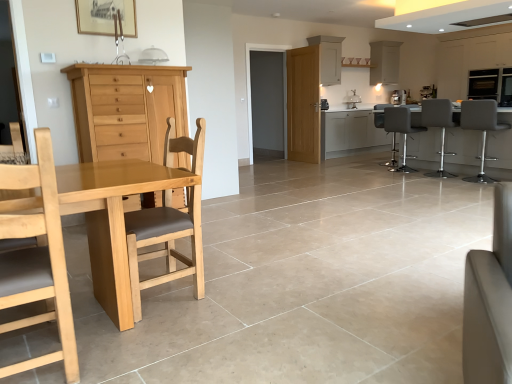
Find the location of a particular element. gray leather bar stool at right, which ranks as the sixth chair in front-to-back order is located at coordinates (392, 154).

The width and height of the screenshot is (512, 384). I want to click on white glossy cabinets at center, marked as the second cabinetry in a back-to-front arrangement, so pos(350,131).

What do you see at coordinates (126, 110) in the screenshot? I see `light brown wood cabinet at left, arranged as the 1th cabinetry when viewed from the left` at bounding box center [126, 110].

The image size is (512, 384). I want to click on matte gray door at center, so click(268, 103).

Is white glossy exhaust hood at upper center in contact with white matte cabinet at upper center, the third cabinetry viewed from the back?

No, white glossy exhaust hood at upper center is not next to white matte cabinet at upper center, the third cabinetry viewed from the back.

Is white glossy exhaust hood at upper center not within white matte cabinet at upper center, the third cabinetry viewed from the back?

Yes, white glossy exhaust hood at upper center is located beyond the bounds of white matte cabinet at upper center, the third cabinetry viewed from the back.

Considering the sizes of white glossy exhaust hood at upper center and white matte cabinet at upper center, the third cabinetry viewed from the back, in the image, is white glossy exhaust hood at upper center wider or thinner than white matte cabinet at upper center, the third cabinetry viewed from the back,?

white glossy exhaust hood at upper center is wider than white matte cabinet at upper center, the third cabinetry viewed from the back.

Consider the image. Is white glossy exhaust hood at upper center to the left or to the right of white matte cabinet at upper center, the fourth cabinetry in the right-to-left sequence, in the image?

Based on their positions, white glossy exhaust hood at upper center is located to the right of white matte cabinet at upper center, the fourth cabinetry in the right-to-left sequence.

Which is behind, light brown wood cabinet at left, arranged as the 1th cabinetry when viewed from the left, or light brown wood table at left?

Positioned behind is light brown wood cabinet at left, arranged as the 1th cabinetry when viewed from the left.

Is point (140, 156) less distant than point (123, 236)?

No, it is behind (123, 236).

From a real-world perspective, which object stands above the other?

In real-world perspective, light brown wood cabinet at left, arranged as the 1th cabinetry when viewed from the left, is above.

Between light brown wood cabinet at left, the fifth cabinetry in the right-to-left sequence, and light brown wood table at left, which one has more height?

With more height is light brown wood cabinet at left, the fifth cabinetry in the right-to-left sequence.

Between white leather couch at lower right and wooden picture frame at upper center, which one has larger width?

white leather couch at lower right.

Find the location of a particular element. This screenshot has width=512, height=384. picture frame above the white leather couch at lower right (from a real-world perspective) is located at coordinates (105, 17).

Which object is positioned more to the right, white leather couch at lower right or wooden picture frame at upper center?

Positioned to the right is white leather couch at lower right.

Considering the sizes of white leather couch at lower right and wooden picture frame at upper center in the image, is white leather couch at lower right taller or shorter than wooden picture frame at upper center?

Considering their sizes, white leather couch at lower right has more height than wooden picture frame at upper center.

Would you say matte grey bar stool at right, positioned as the third chair in left-to-right order, is outside white glossy cabinet at upper center, which ranks as the 1th cabinetry in back-to-front order?

Yes.

Considering the points (403, 130) and (384, 61), which point is in front, point (403, 130) or point (384, 61)?

The point (403, 130) is closer.

Looking at this image, between matte grey bar stool at right, which is the 4th chair in right-to-left order, and white glossy cabinet at upper center, which ranks as the 1th cabinetry in back-to-front order, which one has more height?

matte grey bar stool at right, which is the 4th chair in right-to-left order.

Considering the positions of objects wooden picture frame at upper center and light brown wood cabinet at left, arranged as the 1th cabinetry when viewed from the left, in the image provided, who is more to the left, wooden picture frame at upper center or light brown wood cabinet at left, arranged as the 1th cabinetry when viewed from the left,?

From the viewer's perspective, wooden picture frame at upper center appears more on the left side.

Between point (104, 10) and point (154, 113), which one is positioned in front?

The point (154, 113) is closer.

Is the depth of wooden picture frame at upper center less than that of light brown wood cabinet at left, which appears as the fifth cabinetry when viewed from the back?

No, wooden picture frame at upper center is further to the viewer.

Consider the image. Would you say wooden picture frame at upper center is outside light brown wood cabinet at left, arranged as the 1th cabinetry when viewed from the left?

wooden picture frame at upper center is positioned outside light brown wood cabinet at left, arranged as the 1th cabinetry when viewed from the left.

Where is `cabinetry that is the 2nd one when counting upward from the light brown wood chair at left, the sixth chair from the right (from the image's perspective)`? This screenshot has width=512, height=384. cabinetry that is the 2nd one when counting upward from the light brown wood chair at left, the sixth chair from the right (from the image's perspective) is located at coordinates (350, 131).

Considering the sizes of objects light brown wood chair at left, acting as the 6th chair starting from the back, and white glossy cabinets at center, which is the third cabinetry in right-to-left order, in the image provided, who is taller, light brown wood chair at left, acting as the 6th chair starting from the back, or white glossy cabinets at center, which is the third cabinetry in right-to-left order,?

With more height is light brown wood chair at left, acting as the 6th chair starting from the back.

Is light brown wood chair at left, marked as the 1th chair in a left-to-right arrangement, turned away from white glossy cabinets at center, the fourth cabinetry in the front-to-back sequence?

No, white glossy cabinets at center, the fourth cabinetry in the front-to-back sequence, is not at the back of light brown wood chair at left, marked as the 1th chair in a left-to-right arrangement.

Which is less distant, [74,376] or [323,120]?

Positioned in front is point [74,376].

Does point (446, 81) lie behind point (119, 5)?

Yes, point (446, 81) is farther from viewer.

Is matte white cabinet at upper right, acting as the first cabinetry starting from the right, smaller than wooden picture frame at upper center?

Incorrect, matte white cabinet at upper right, acting as the first cabinetry starting from the right, is not smaller in size than wooden picture frame at upper center.

How many degrees apart are the facing directions of matte white cabinet at upper right, acting as the first cabinetry starting from the right, and wooden picture frame at upper center?

The angle between the facing direction of matte white cabinet at upper right, acting as the first cabinetry starting from the right, and the facing direction of wooden picture frame at upper center is 89.6 degrees.

Identify the location of exhaust hood above the white matte cabinet at upper center, the third cabinetry viewed from the back (from a real-world perspective). This screenshot has height=384, width=512. (446, 15).

You are a GUI agent. You are given a task and a screenshot of the screen. Output one action in this format:
    pyautogui.click(x=<x>, y=<y>)
    Task: Click on the kitchen & dining room table to the right of light brown wood cabinet at left, the first cabinetry from the front
    The width and height of the screenshot is (512, 384).
    Given the screenshot: What is the action you would take?
    pyautogui.click(x=112, y=220)

Estimate the real-world distances between objects in this image. Which object is further from gray leather bar stool at right, which ranks as the sixth chair in front-to-back order, white leather couch at lower right or matte gray door at center?

The object further to gray leather bar stool at right, which ranks as the sixth chair in front-to-back order, is white leather couch at lower right.

Which object lies further to the anchor point white matte cabinet at upper center, arranged as the second cabinetry when viewed from the left, white glossy exhaust hood at upper center or matte gray barstools at right?

The object further to white matte cabinet at upper center, arranged as the second cabinetry when viewed from the left, is white glossy exhaust hood at upper center.

From the image, which object appears to be farther from wooden picture frame at upper center, matte gray door at center or gray leather bar stool at right, the 1th chair when ordered from back to front?

The object further to wooden picture frame at upper center is matte gray door at center.

Considering their positions, is white leather couch at lower right positioned further to light brown wood table at left than white glossy cabinets at center, which is the third cabinetry in right-to-left order?

The object further to light brown wood table at left is white glossy cabinets at center, which is the third cabinetry in right-to-left order.

Looking at the image, which one is located closer to light brown wood cabinet at left, which appears as the fifth cabinetry when viewed from the back, matte white cabinet at upper right, which is the second cabinetry in front-to-back order, or white glossy exhaust hood at upper center?

Among the two, white glossy exhaust hood at upper center is located nearer to light brown wood cabinet at left, which appears as the fifth cabinetry when viewed from the back.

Looking at the image, which one is located closer to white glossy cabinet at upper center, which ranks as the 1th cabinetry in back-to-front order, white matte cabinet at upper center, the third cabinetry viewed from the front, or light brown wood cabinet at left, which appears as the fifth cabinetry when viewed from the back?

The object closer to white glossy cabinet at upper center, which ranks as the 1th cabinetry in back-to-front order, is white matte cabinet at upper center, the third cabinetry viewed from the front.

From the image, which object appears to be nearer to light brown wood table at left, light brown wood cabinet at left, which appears as the fifth cabinetry when viewed from the back, or gray leather bar stool at right, acting as the third chair starting from the right?

light brown wood cabinet at left, which appears as the fifth cabinetry when viewed from the back, is closer to light brown wood table at left.

Based on their spatial positions, is light brown wood chair at left, which ranks as the 5th chair in right-to-left order, or white glossy exhaust hood at upper center further from white matte cabinet at upper center, arranged as the second cabinetry when viewed from the left?

light brown wood chair at left, which ranks as the 5th chair in right-to-left order, lies further to white matte cabinet at upper center, arranged as the second cabinetry when viewed from the left, than the other object.

At what (x,y) coordinates should I click in order to perform the action: click on cabinetry between white leather couch at lower right and matte gray barstools at right in the front-back direction. Please return your answer as a coordinate pair (x, y). This screenshot has height=384, width=512. Looking at the image, I should click on (126, 110).

This screenshot has height=384, width=512. In order to click on exhaust hood between light brown wood chair at left, marked as the 1th chair in a left-to-right arrangement, and gray leather bar stool at right, which ranks as the sixth chair in front-to-back order, in the front-back direction in this screenshot , I will do `click(446, 15)`.

What are the coordinates of `exhaust hood between white leather couch at lower right and matte grey bar stool at right, positioned as the third chair in left-to-right order, along the z-axis` in the screenshot? It's located at (446, 15).

Identify the location of glass door positioned between light brown wood chair at left, acting as the 6th chair starting from the back, and white glossy cabinet at upper center, which is counted as the second cabinetry, starting from the right, from near to far. (268, 103).